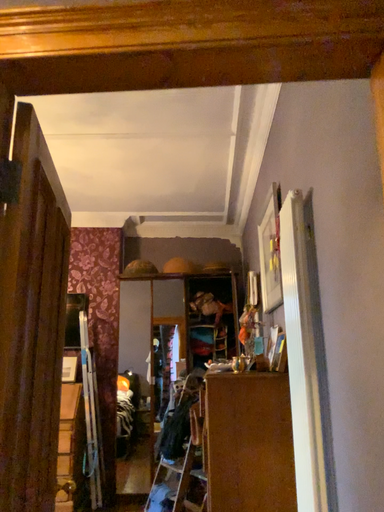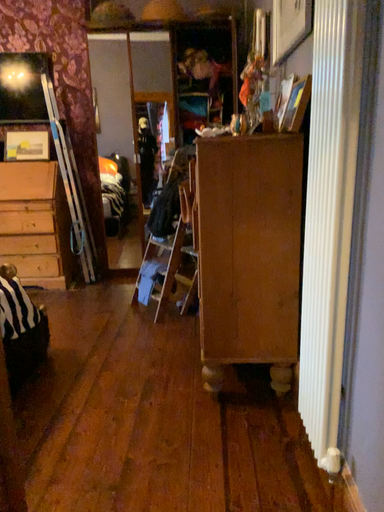
Question: How did the camera likely rotate when shooting the video?

Choices:
 (A) rotated downward
 (B) rotated upward

Answer: (A)